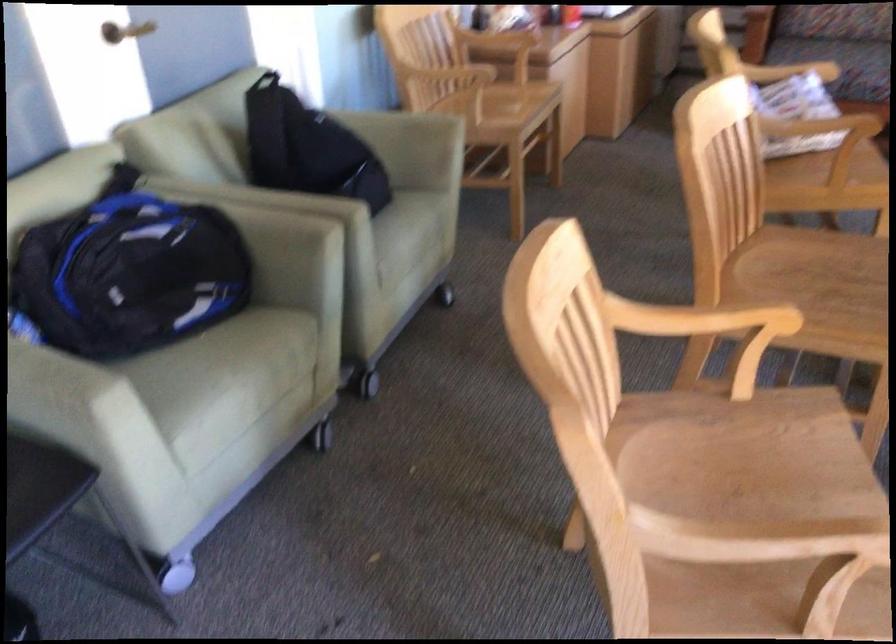
You are a GUI agent. You are given a task and a screenshot of the screen. Output one action in this format:
    pyautogui.click(x=<x>, y=<y>)
    Task: Click on the brass door handle
    Image resolution: width=896 pixels, height=644 pixels.
    Given the screenshot: What is the action you would take?
    pyautogui.click(x=125, y=31)